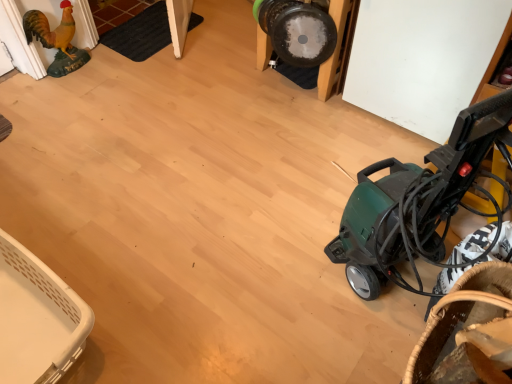
Image resolution: width=512 pixels, height=384 pixels. Identify the location of vacant region under white plastic basket at lower left, the 1th basket in the back-to-front sequence (from a real-world perspective). (31, 329).